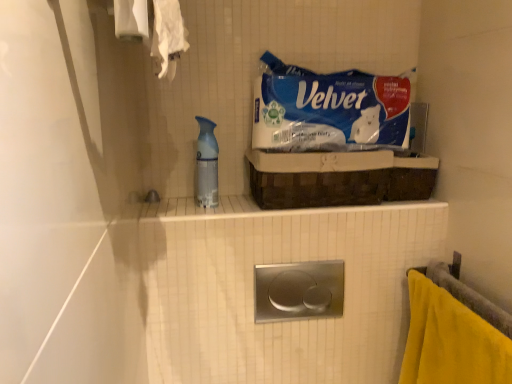
At what (x,y) coordinates should I click in order to perform the action: click on vacant space to the right of translucent plastic spray bottle at center. Please return your answer as a coordinate pair (x, y). The height and width of the screenshot is (384, 512). Looking at the image, I should click on [x=248, y=210].